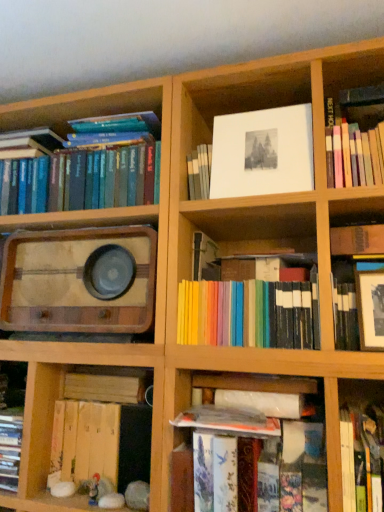
Question: Is hardcover books at left, which is the 7th book in right-to-left order, taller than wooden plank at lower left, the 2th book when ordered from left to right?

Choices:
 (A) yes
 (B) no

Answer: (A)

Question: Is hardcover books at left, placed as the 1th book when sorted from left to right, outside wooden plank at lower left, the 6th book positioned from the right?

Choices:
 (A) no
 (B) yes

Answer: (B)

Question: Does hardcover books at left, which is the 7th book in right-to-left order, have a larger size compared to wooden plank at lower left, the 6th book positioned from the right?

Choices:
 (A) no
 (B) yes

Answer: (B)

Question: From a real-world perspective, is hardcover books at left, which is the 7th book in right-to-left order, positioned over wooden plank at lower left, the 6th book positioned from the right, based on gravity?

Choices:
 (A) yes
 (B) no

Answer: (A)

Question: Does hardcover books at left, placed as the 1th book when sorted from left to right, have a lesser width compared to wooden plank at lower left, the 6th book positioned from the right?

Choices:
 (A) yes
 (B) no

Answer: (B)

Question: Is hardcover books at left, placed as the 1th book when sorted from left to right, at the right side of wooden plank at lower left, the 6th book positioned from the right?

Choices:
 (A) no
 (B) yes

Answer: (A)

Question: Is hardcover books at lower center taller than wooden vintage radio at left?

Choices:
 (A) yes
 (B) no

Answer: (B)

Question: Are hardcover books at lower center and wooden vintage radio at left beside each other?

Choices:
 (A) yes
 (B) no

Answer: (B)

Question: Is wooden vintage radio at left located within hardcover books at lower center?

Choices:
 (A) no
 (B) yes

Answer: (A)

Question: Is hardcover books at lower center closer to camera compared to wooden vintage radio at left?

Choices:
 (A) no
 (B) yes

Answer: (B)

Question: From a real-world perspective, is hardcover books at lower center positioned under wooden vintage radio at left based on gravity?

Choices:
 (A) no
 (B) yes

Answer: (B)

Question: Is hardcover books at lower center bigger than wooden vintage radio at left?

Choices:
 (A) yes
 (B) no

Answer: (B)

Question: Is matte black frame at upper right, marked as the sixth book in a left-to-right arrangement, positioned in front of wooden vintage radio at left?

Choices:
 (A) no
 (B) yes

Answer: (B)